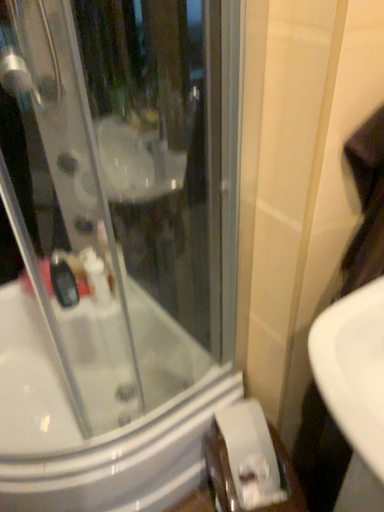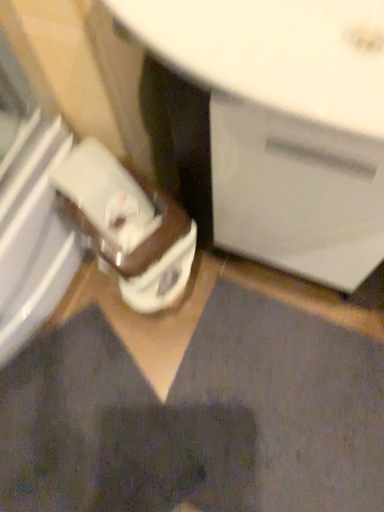
Question: How did the camera likely rotate when shooting the video?

Choices:
 (A) rotated right
 (B) rotated left

Answer: (A)